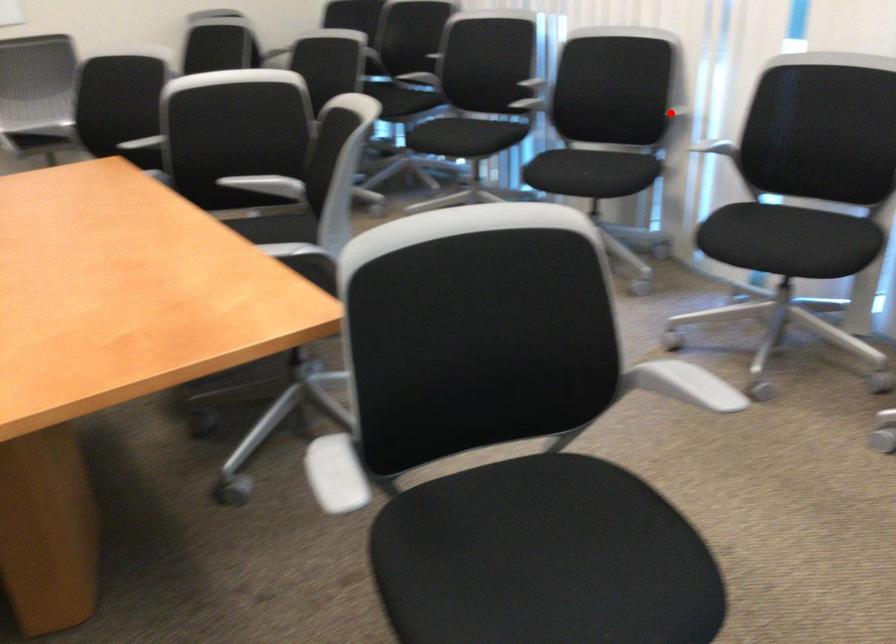
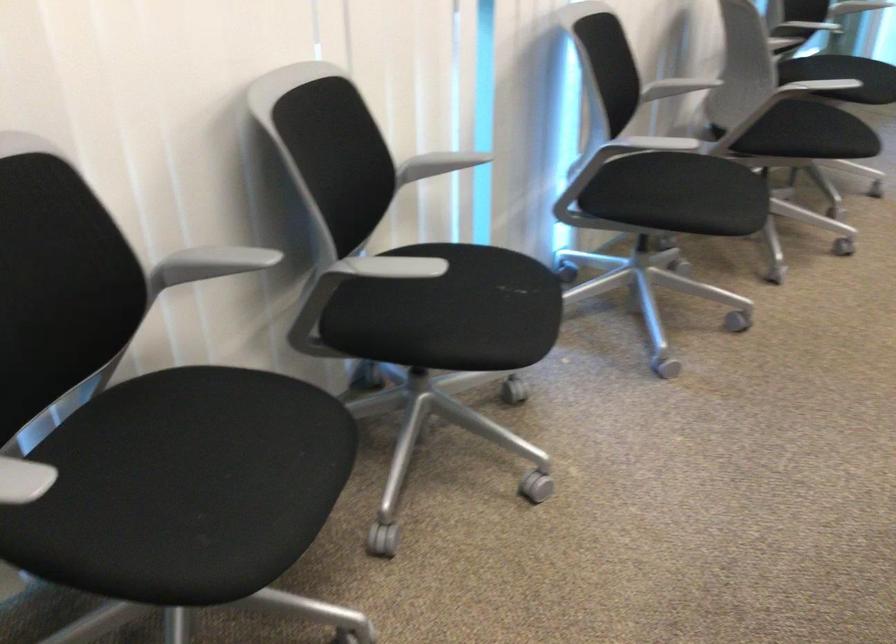
The point at the highlighted location is marked in the first image. Where is the corresponding point in the second image?

(438, 164)